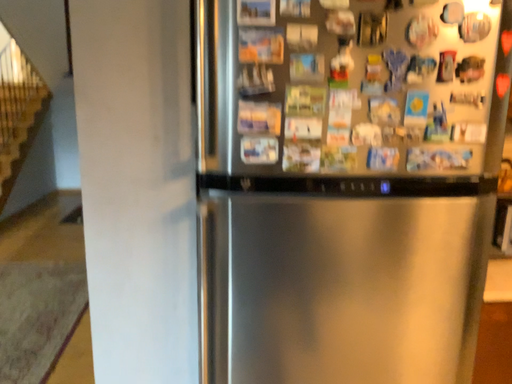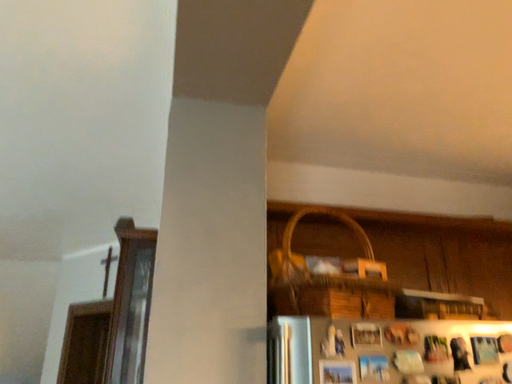
Question: Which way did the camera rotate in the video?

Choices:
 (A) rotated left
 (B) rotated right

Answer: (B)